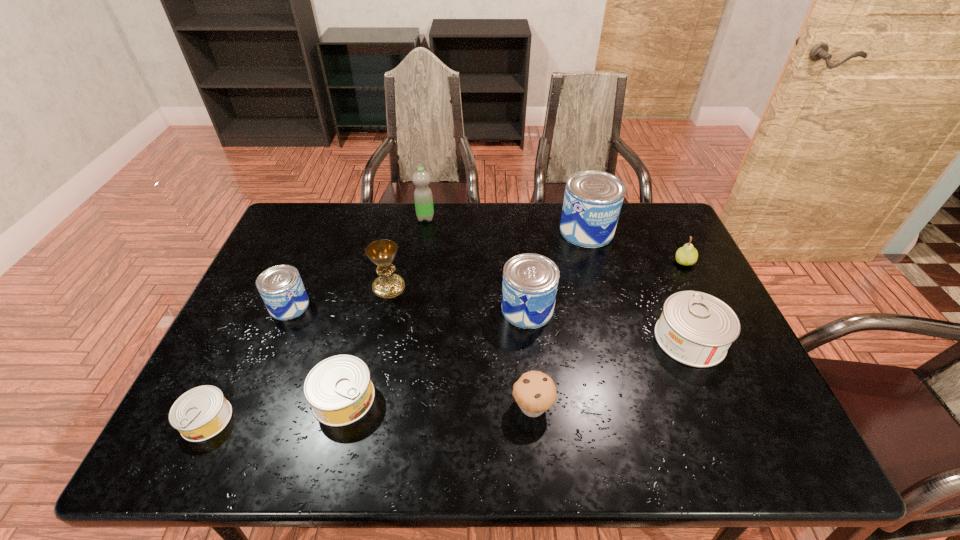
Locate an element on the screen. The image size is (960, 540). muffin present at the near edge is located at coordinates (535, 392).

Locate an element on the screen. This screenshot has width=960, height=540. pear located in the right edge section of the desktop is located at coordinates (687, 255).

Find the location of a particular element. Image resolution: width=960 pixels, height=540 pixels. can at the right edge is located at coordinates (696, 329).

At what (x,y) coordinates should I click in order to perform the action: click on object positioned at the near left corner. Please return your answer as a coordinate pair (x, y). Looking at the image, I should click on (201, 413).

Locate an element on the screen. This screenshot has width=960, height=540. vacant space at the far edge of the desktop is located at coordinates (x=444, y=239).

This screenshot has width=960, height=540. I want to click on free space at the left edge, so click(x=275, y=362).

Where is `free space at the far left corner`? Image resolution: width=960 pixels, height=540 pixels. free space at the far left corner is located at coordinates (291, 227).

The width and height of the screenshot is (960, 540). What are the coordinates of `blank region between the third object from right to left and the farthest silver can` in the screenshot? It's located at (638, 285).

Locate an element on the screen. free space that is in between the leftmost blue can and the second blue can from right to left is located at coordinates (408, 307).

Locate an element on the screen. free space between the third can from left to right and the farthest blue can is located at coordinates (466, 314).